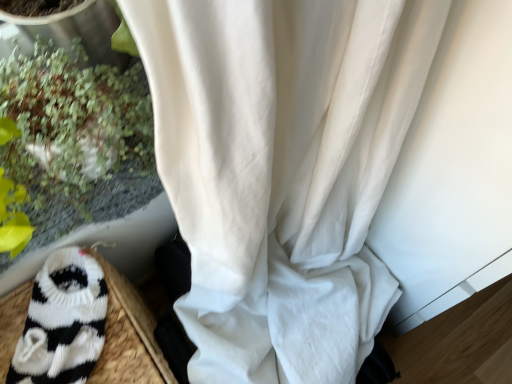
Question: Is green leafy plant at left looking in the opposite direction of white sheer curtain at center?

Choices:
 (A) yes
 (B) no

Answer: (B)

Question: From a real-world perspective, is green leafy plant at left physically above white sheer curtain at center?

Choices:
 (A) yes
 (B) no

Answer: (A)

Question: From the image's perspective, is green leafy plant at left located beneath white sheer curtain at center?

Choices:
 (A) no
 (B) yes

Answer: (A)

Question: Is green leafy plant at left facing towards white sheer curtain at center?

Choices:
 (A) no
 (B) yes

Answer: (A)

Question: Is there a large distance between green leafy plant at left and white sheer curtain at center?

Choices:
 (A) no
 (B) yes

Answer: (A)

Question: Considering the positions of white sheer curtain at center and green leafy plant at left in the image, is white sheer curtain at center bigger or smaller than green leafy plant at left?

Choices:
 (A) small
 (B) big

Answer: (B)

Question: Considering the positions of white sheer curtain at center and green leafy plant at left in the image, is white sheer curtain at center taller or shorter than green leafy plant at left?

Choices:
 (A) tall
 (B) short

Answer: (A)

Question: Is white sheer curtain at center to the left or to the right of green leafy plant at left in the image?

Choices:
 (A) left
 (B) right

Answer: (B)

Question: Is white sheer curtain at center inside or outside of green leafy plant at left?

Choices:
 (A) inside
 (B) outside

Answer: (B)

Question: Does point (321, 119) appear closer or farther from the camera than point (46, 372)?

Choices:
 (A) closer
 (B) farther

Answer: (A)

Question: From the image's perspective, relative to black knitted sock at lower left, is white sheer curtain at center above or below?

Choices:
 (A) above
 (B) below

Answer: (B)

Question: From a real-world perspective, is white sheer curtain at center above or below black knitted sock at lower left?

Choices:
 (A) below
 (B) above

Answer: (A)

Question: Is white sheer curtain at center to the left or to the right of black knitted sock at lower left in the image?

Choices:
 (A) right
 (B) left

Answer: (A)

Question: In the image, is green leafy plant at left on the left side or the right side of white sheer curtain at center?

Choices:
 (A) right
 (B) left

Answer: (B)

Question: Is point (94, 160) positioned closer to the camera than point (325, 1)?

Choices:
 (A) farther
 (B) closer

Answer: (A)